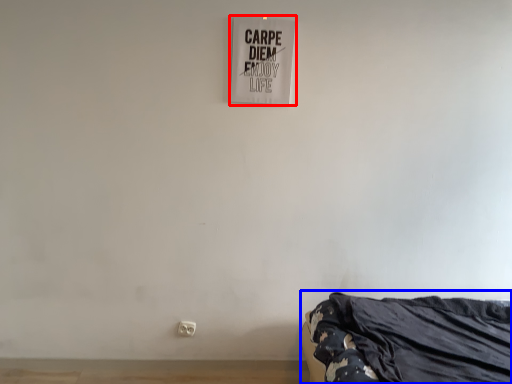
Question: Among these objects, which one is nearest to the camera, signage (highlighted by a red box) or furniture (highlighted by a blue box)?

Choices:
 (A) signage
 (B) furniture

Answer: (B)